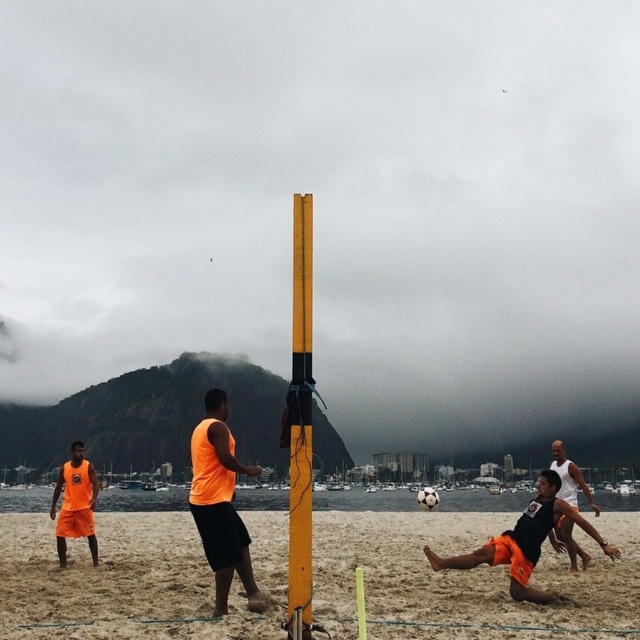
Question: Does yellow painted wood pole at center appear on the left side of orange jersey at center?

Choices:
 (A) yes
 (B) no

Answer: (A)

Question: Considering the relative positions of orange fabric shirt at center and white matte volleyball at center in the image provided, where is orange fabric shirt at center located with respect to white matte volleyball at center?

Choices:
 (A) below
 (B) above

Answer: (B)

Question: Can you confirm if yellow painted wood pole at center is positioned above black matte soccer player at center?

Choices:
 (A) no
 (B) yes

Answer: (A)

Question: Considering the real-world distances, which object is farthest from the white matte volleyball at center?

Choices:
 (A) yellow painted wood pole at center
 (B) black matte soccer player at center

Answer: (A)

Question: Which point is farther to the camera?

Choices:
 (A) orange jersey at center
 (B) black matte soccer player at center

Answer: (A)

Question: Which of the following is the farthest from the observer?

Choices:
 (A) orange fabric shorts at lower left
 (B) sandy beach at center
 (C) orange fabric shirt at center
 (D) yellow painted wood pole at center

Answer: (A)